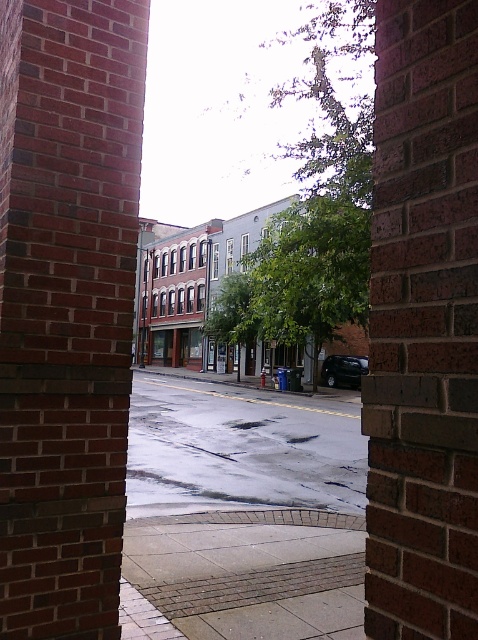
Question: Among these points, which one is farthest from the camera?

Choices:
 (A) (150, 476)
 (B) (133, 557)
 (C) (352, 356)

Answer: (C)

Question: Which object is farther from the camera taking this photo?

Choices:
 (A) shiny black car at center
 (B) smooth concrete pavement at center

Answer: (A)

Question: Which of the following is the closest to the observer?

Choices:
 (A) wet asphalt at center
 (B) shiny black car at center

Answer: (A)

Question: Is smooth concrete pavement at center above shiny black car at center?

Choices:
 (A) no
 (B) yes

Answer: (B)

Question: In this image, where is smooth concrete pavement at center located relative to shiny black car at center?

Choices:
 (A) below
 (B) above

Answer: (B)

Question: Is smooth concrete pavement at center positioned behind wet asphalt at center?

Choices:
 (A) yes
 (B) no

Answer: (B)